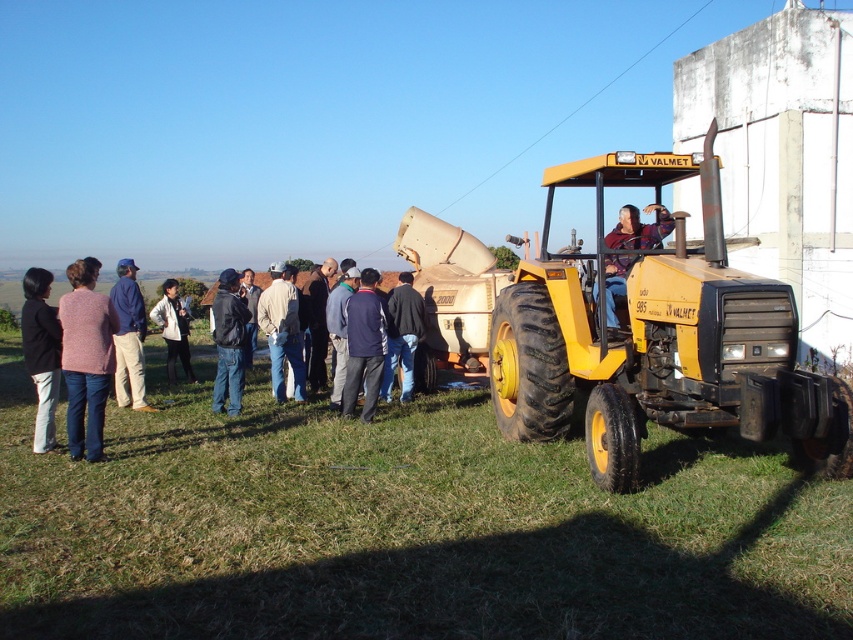
Looking at this image, you are standing at point [41,353] in the image. What object is located at this point?

The dark gray jacket at left is located at point [41,353].

You are standing at the origin point of the coordinate system. Based on the image, where is the green grass at lower center located?

The green grass at lower center is located at point 0.827 on the x axis and 0.472 on the y axis.

Looking at this image, you are part of the group observing the yellow Valmet tractor. You notice two jackets at the center of the scene. Which jacket is located to the left when looking at the matte black jacket at center and the navy blue jacket at center?

The matte black jacket at center is positioned on the left side of the navy blue jacket at center, so the matte black jacket at center is located to the left.